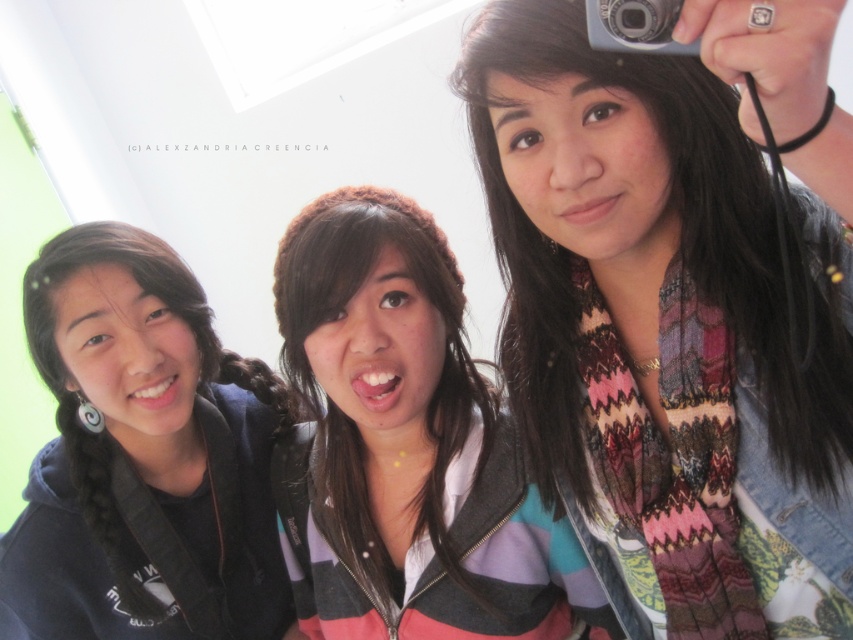
Question: Is black matte hoodie at left above silver metallic camera at upper right?

Choices:
 (A) yes
 (B) no

Answer: (B)

Question: Which of these objects is positioned closest to the multicolored scarf at center?

Choices:
 (A) black matte hoodie at left
 (B) striped hoodie at center

Answer: (B)

Question: Among these objects, which one is farthest from the camera?

Choices:
 (A) multicolored scarf at center
 (B) black matte hoodie at left
 (C) silver metallic camera at upper right
 (D) striped hoodie at center

Answer: (B)

Question: Is multicolored scarf at center to the right of black matte hoodie at left from the viewer's perspective?

Choices:
 (A) no
 (B) yes

Answer: (B)

Question: Which of the following is the closest to the observer?

Choices:
 (A) (36, 499)
 (B) (500, 609)
 (C) (653, 1)

Answer: (C)

Question: Is multicolored scarf at center bigger than black matte hoodie at left?

Choices:
 (A) no
 (B) yes

Answer: (B)